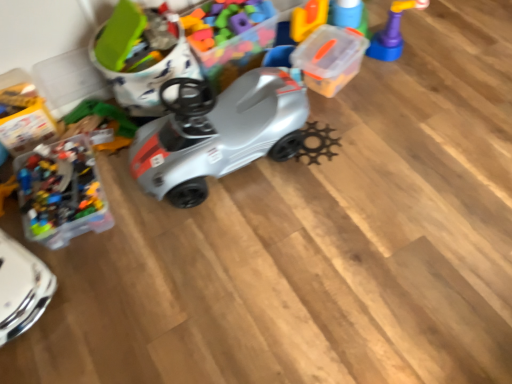
How much space does transparent plastic container at upper right, the second toy when ordered from right to left, occupy horizontally?

It is 9.93 inches.

What is the approximate width of matte plastic toy car at upper left, placed as the third toy when sorted from right to left?

matte plastic toy car at upper left, placed as the third toy when sorted from right to left, is 42.41 centimeters wide.

In order to click on rubberized plastic toy at upper right, placed as the 1th toy when sorted from right to left in this screenshot , I will do `click(392, 32)`.

This screenshot has width=512, height=384. Find the location of `transparent plastic container at upper right, the 2th toy viewed from the left`. transparent plastic container at upper right, the 2th toy viewed from the left is located at coordinates coord(330,58).

From the image's perspective, would you say transparent plastic container at upper right, the second toy when ordered from right to left, is positioned over matte plastic toy car at upper left, placed as the third toy when sorted from right to left?

Yes.

Is transparent plastic container at upper right, the 2th toy viewed from the left, closer to camera compared to matte plastic toy car at upper left, which is counted as the 1th toy, starting from the left?

No, it is not.

Would you say transparent plastic container at upper right, the 2th toy viewed from the left, is outside matte plastic toy car at upper left, which is counted as the 1th toy, starting from the left?

Yes.

Between transparent plastic container at upper right, the second toy when ordered from right to left, and matte plastic toy car at upper left, placed as the third toy when sorted from right to left, which one has less height?

Standing shorter between the two is transparent plastic container at upper right, the second toy when ordered from right to left.

Is point (145, 85) positioned in front of point (347, 65)?

Yes, it is.

Would you say matte plastic toy car at upper left, which is counted as the 1th toy, starting from the left, is inside or outside transparent plastic container at upper right, the second toy when ordered from right to left?

matte plastic toy car at upper left, which is counted as the 1th toy, starting from the left, is not enclosed by transparent plastic container at upper right, the second toy when ordered from right to left.

Considering the relative positions of matte plastic toy car at upper left, placed as the third toy when sorted from right to left, and transparent plastic container at upper right, the second toy when ordered from right to left, in the image provided, is matte plastic toy car at upper left, placed as the third toy when sorted from right to left, to the left of transparent plastic container at upper right, the second toy when ordered from right to left, from the viewer's perspective?

Yes.

Who is shorter, matte plastic toy car at upper left, which is counted as the 1th toy, starting from the left, or transparent plastic container at upper right, the second toy when ordered from right to left?

Standing shorter between the two is transparent plastic container at upper right, the second toy when ordered from right to left.

Does point (376, 42) come behind point (186, 60)?

That is True.

From the image's perspective, who appears lower, rubberized plastic toy at upper right, acting as the 3th toy starting from the left, or matte plastic toy car at upper left, which is counted as the 1th toy, starting from the left?

matte plastic toy car at upper left, which is counted as the 1th toy, starting from the left, is shown below in the image.

Is rubberized plastic toy at upper right, acting as the 3th toy starting from the left, taller or shorter than matte plastic toy car at upper left, placed as the third toy when sorted from right to left?

Considering their sizes, rubberized plastic toy at upper right, acting as the 3th toy starting from the left, has less height than matte plastic toy car at upper left, placed as the third toy when sorted from right to left.

Does rubberized plastic toy at upper right, placed as the 1th toy when sorted from right to left, have a lesser width compared to transparent plastic container at upper right, the 2th toy viewed from the left?

Indeed, rubberized plastic toy at upper right, placed as the 1th toy when sorted from right to left, has a lesser width compared to transparent plastic container at upper right, the 2th toy viewed from the left.

Based on their sizes in the image, would you say rubberized plastic toy at upper right, acting as the 3th toy starting from the left, is bigger or smaller than transparent plastic container at upper right, the second toy when ordered from right to left?

Considering their sizes, rubberized plastic toy at upper right, acting as the 3th toy starting from the left, takes up less space than transparent plastic container at upper right, the second toy when ordered from right to left.

Between point (396, 9) and point (355, 69), which one is positioned behind?

The point (396, 9) is more distant.

Can you confirm if rubberized plastic toy at upper right, acting as the 3th toy starting from the left, is taller than transparent plastic container at upper right, the second toy when ordered from right to left?

Indeed, rubberized plastic toy at upper right, acting as the 3th toy starting from the left, has a greater height compared to transparent plastic container at upper right, the second toy when ordered from right to left.

From a real-world perspective, relative to rubberized plastic toy at upper right, acting as the 3th toy starting from the left, is transparent plastic container at upper right, the second toy when ordered from right to left, vertically above or below?

transparent plastic container at upper right, the second toy when ordered from right to left, is situated lower than rubberized plastic toy at upper right, acting as the 3th toy starting from the left, in the real world.

Does transparent plastic container at upper right, the 2th toy viewed from the left, contain rubberized plastic toy at upper right, acting as the 3th toy starting from the left?

No, rubberized plastic toy at upper right, acting as the 3th toy starting from the left, is not inside transparent plastic container at upper right, the 2th toy viewed from the left.

Does transparent plastic container at upper right, the 2th toy viewed from the left, have a larger size compared to rubberized plastic toy at upper right, placed as the 1th toy when sorted from right to left?

Yes, transparent plastic container at upper right, the 2th toy viewed from the left, is bigger than rubberized plastic toy at upper right, placed as the 1th toy when sorted from right to left.

Does transparent plastic container at upper right, the second toy when ordered from right to left, lie behind rubberized plastic toy at upper right, placed as the 1th toy when sorted from right to left?

No, transparent plastic container at upper right, the second toy when ordered from right to left, is in front of rubberized plastic toy at upper right, placed as the 1th toy when sorted from right to left.

Is matte plastic toy car at upper left, placed as the third toy when sorted from right to left, with rubberized plastic toy at upper right, acting as the 3th toy starting from the left?

No, matte plastic toy car at upper left, placed as the third toy when sorted from right to left, is not next to rubberized plastic toy at upper right, acting as the 3th toy starting from the left.

Based on the photo, based on their sizes in the image, would you say matte plastic toy car at upper left, placed as the third toy when sorted from right to left, is bigger or smaller than rubberized plastic toy at upper right, acting as the 3th toy starting from the left?

In the image, matte plastic toy car at upper left, placed as the third toy when sorted from right to left, appears to be larger than rubberized plastic toy at upper right, acting as the 3th toy starting from the left.

Is matte plastic toy car at upper left, which is counted as the 1th toy, starting from the left, positioned behind rubberized plastic toy at upper right, placed as the 1th toy when sorted from right to left?

No, matte plastic toy car at upper left, which is counted as the 1th toy, starting from the left, is closer to the camera.

From the image's perspective, starting from the matte plastic toy car at upper left, placed as the third toy when sorted from right to left, which toy is the 1st one above? Please provide its 2D coordinates.

[(330, 58)]

The image size is (512, 384). Identify the location of toy on the left of transparent plastic container at upper right, the 2th toy viewed from the left. (141, 56).

Consider the image. Considering their positions, is transparent plastic container at upper right, the 2th toy viewed from the left, positioned closer to matte plastic toy car at upper left, placed as the third toy when sorted from right to left, than rubberized plastic toy at upper right, acting as the 3th toy starting from the left?

The object closer to matte plastic toy car at upper left, placed as the third toy when sorted from right to left, is transparent plastic container at upper right, the 2th toy viewed from the left.

From the image, which object appears to be farther from matte plastic toy car at upper left, placed as the third toy when sorted from right to left, rubberized plastic toy at upper right, acting as the 3th toy starting from the left, or transparent plastic container at upper right, the 2th toy viewed from the left?

Among the two, rubberized plastic toy at upper right, acting as the 3th toy starting from the left, is located further to matte plastic toy car at upper left, placed as the third toy when sorted from right to left.

When comparing their distances from transparent plastic container at upper right, the 2th toy viewed from the left, does matte plastic toy car at upper left, which is counted as the 1th toy, starting from the left, or rubberized plastic toy at upper right, acting as the 3th toy starting from the left, seem closer?

rubberized plastic toy at upper right, acting as the 3th toy starting from the left, lies closer to transparent plastic container at upper right, the 2th toy viewed from the left, than the other object.

Which object lies further to the anchor point rubberized plastic toy at upper right, placed as the 1th toy when sorted from right to left, transparent plastic container at upper right, the second toy when ordered from right to left, or matte plastic toy car at upper left, which is counted as the 1th toy, starting from the left?

Based on the image, matte plastic toy car at upper left, which is counted as the 1th toy, starting from the left, appears to be further to rubberized plastic toy at upper right, placed as the 1th toy when sorted from right to left.

Based on their spatial positions, is matte plastic toy car at upper left, placed as the third toy when sorted from right to left, or transparent plastic container at upper right, the second toy when ordered from right to left, closer to rubberized plastic toy at upper right, acting as the 3th toy starting from the left?

Based on the image, transparent plastic container at upper right, the second toy when ordered from right to left, appears to be nearer to rubberized plastic toy at upper right, acting as the 3th toy starting from the left.

Estimate the real-world distances between objects in this image. Which object is closer to transparent plastic container at upper right, the 2th toy viewed from the left, rubberized plastic toy at upper right, acting as the 3th toy starting from the left, or matte plastic toy car at upper left, which is counted as the 1th toy, starting from the left?

rubberized plastic toy at upper right, acting as the 3th toy starting from the left, lies closer to transparent plastic container at upper right, the 2th toy viewed from the left, than the other object.

The width and height of the screenshot is (512, 384). Identify the location of toy between matte plastic toy car at upper left, which is counted as the 1th toy, starting from the left, and rubberized plastic toy at upper right, placed as the 1th toy when sorted from right to left, from left to right. (330, 58).